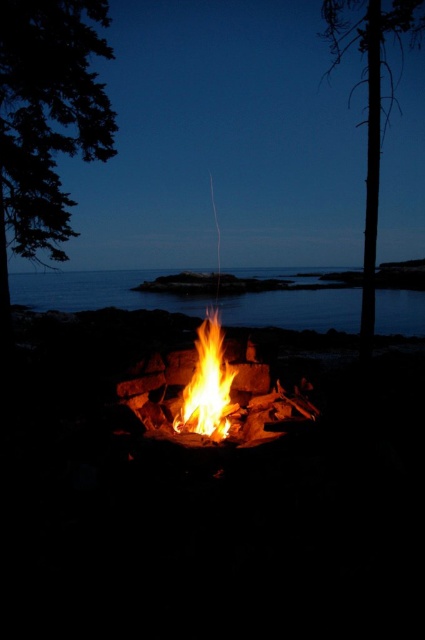
From the picture: You are standing in front of the campfire at night and notice two points in the scene. The first point is labeled as point (308, 410) and the second is point (215, 403). Which point is nearer to your viewpoint?

Point (308, 410) is closer to the camera than point (215, 403).